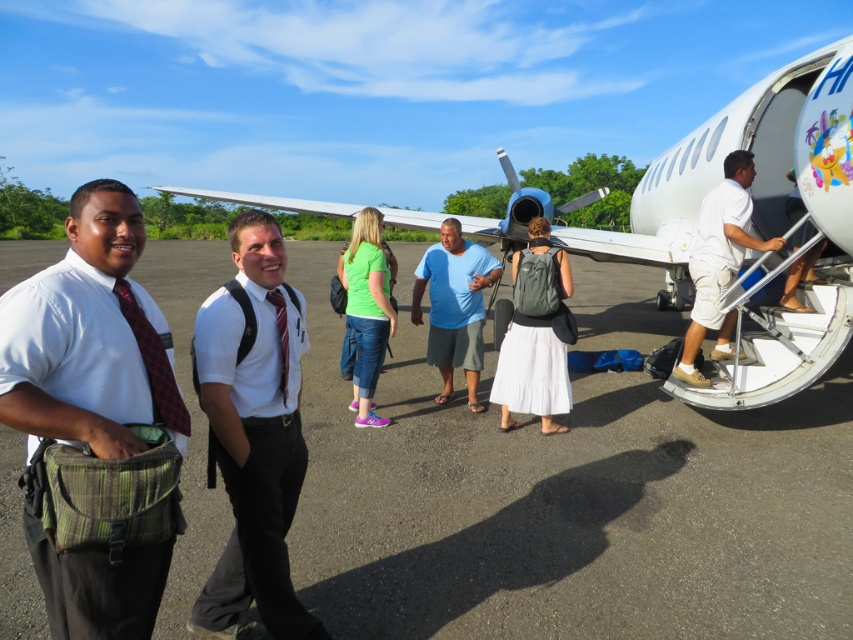
Can you confirm if white woven bag at left is smaller than green matte shirt at center?

Indeed, white woven bag at left has a smaller size compared to green matte shirt at center.

Between white woven bag at left and green matte shirt at center, which one is positioned higher?

Positioned higher is green matte shirt at center.

Locate an element on the screen. The width and height of the screenshot is (853, 640). white woven bag at left is located at coordinates (90, 337).

Between white matte airplane at right and matte gray backpack at center, which one has more height?

Standing taller between the two is white matte airplane at right.

Between point (811, 170) and point (556, 300), which one is positioned in front?

Point (811, 170) is in front.

Find the location of `white matte airplane at right`. white matte airplane at right is located at coordinates (755, 168).

Can you confirm if white woven bag at left is thinner than red silk tie at center?

Incorrect, white woven bag at left's width is not less than red silk tie at center's.

Looking at this image, who is positioned more to the left, white woven bag at left or red silk tie at center?

white woven bag at left

Is point (88, 196) behind point (270, 292)?

That is False.

Where is `white woven bag at left`? white woven bag at left is located at coordinates (90, 337).